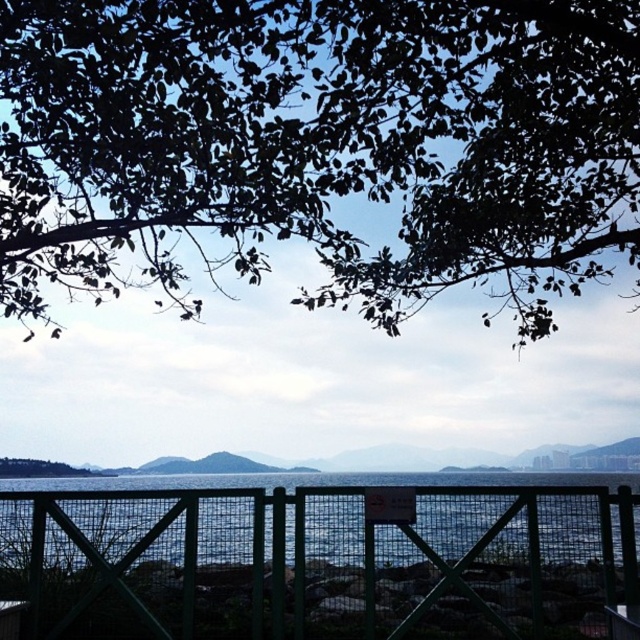
Can you confirm if green leafy tree at upper center is bigger than green metal fence at lower center?

Yes.

What do you see at coordinates (320, 141) in the screenshot?
I see `green leafy tree at upper center` at bounding box center [320, 141].

Which is behind, point (440, 129) or point (595, 560)?

Positioned behind is point (595, 560).

I want to click on green leafy tree at upper center, so click(320, 141).